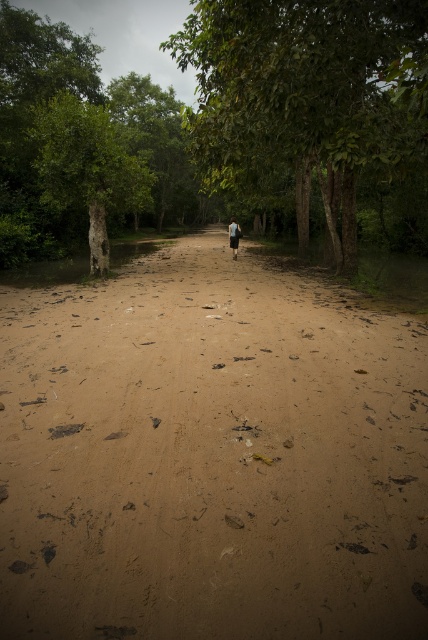
Question: Is brown sandy dirt track at center to the left of dark blue fabric at center from the viewer's perspective?

Choices:
 (A) no
 (B) yes

Answer: (B)

Question: Which point is farther to the camera?

Choices:
 (A) brown sandy dirt track at center
 (B) dark blue fabric at center

Answer: (B)

Question: Does brown sandy dirt track at center appear under green leafy tree at center?

Choices:
 (A) yes
 (B) no

Answer: (A)

Question: Which point is farther to the camera?

Choices:
 (A) (306, 429)
 (B) (238, 163)

Answer: (B)

Question: Is brown sandy dirt track at center positioned behind green matte tree at left?

Choices:
 (A) yes
 (B) no

Answer: (B)

Question: Which object is the farthest from the green matte tree at left?

Choices:
 (A) green leafy tree at center
 (B) dark blue fabric at center
 (C) brown sandy dirt track at center

Answer: (C)